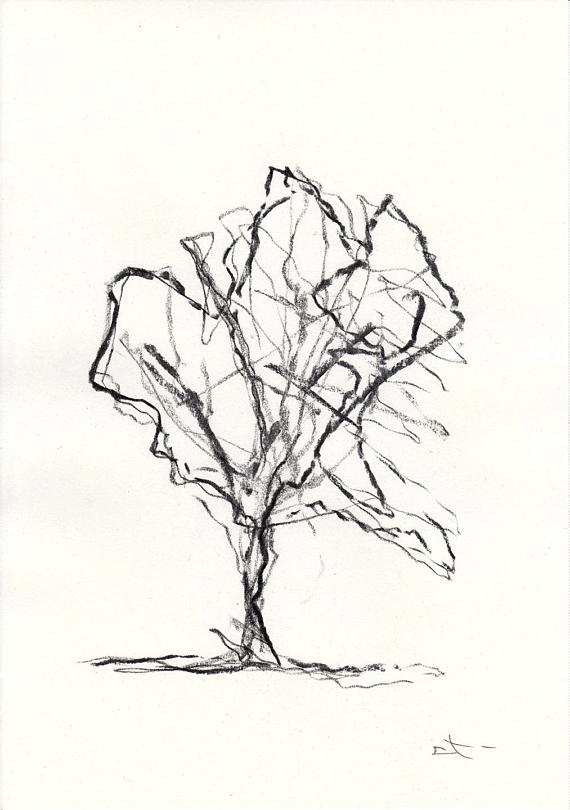
Locate an element on the screen. Image resolution: width=570 pixels, height=810 pixels. shade is located at coordinates (203, 674).